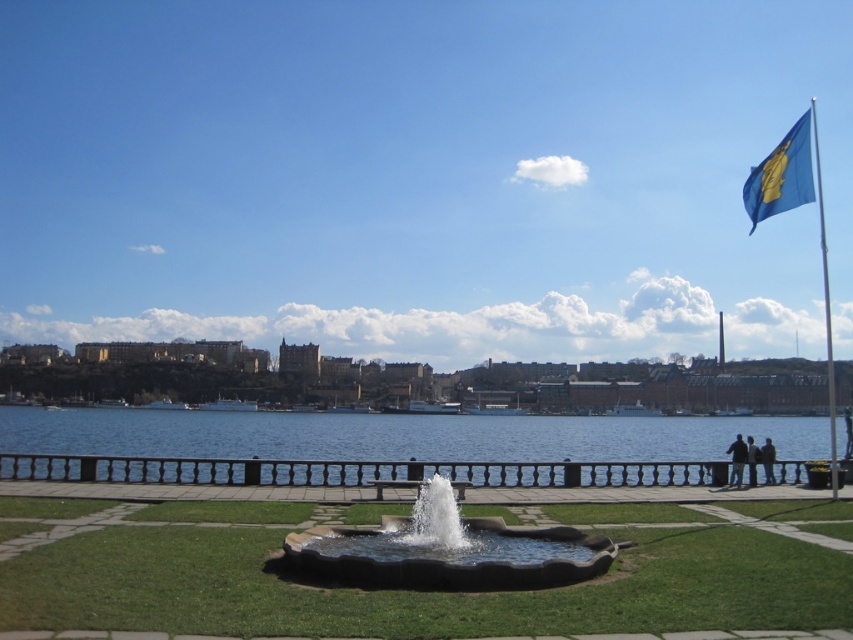
You are standing at the edge of the waterfront scene. You want to walk to the green grass at center. According to the coordinates provided, in which direction should you move relative to your current position?

The green grass at center is located at coordinates point (396, 589). Since you are at the edge near the water, you should move towards the center of the scene to reach it.

You are standing at the edge of the waterfront scene and want to determine the relative positions of two points marked in the image. Which point, point [363,614] or point [743,465], is closer to you?

Point [363,614] is closer to the viewer than point [743,465].